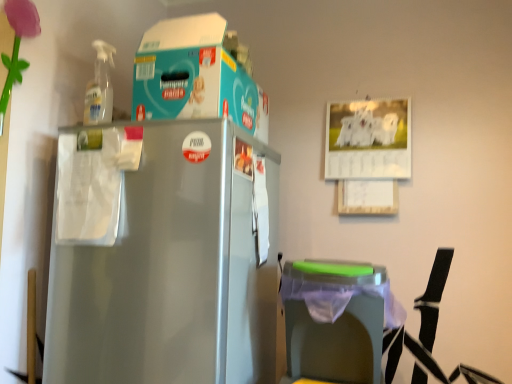
Question: Can you confirm if teal cardboard box at upper center is shorter than green plastic trash can at lower right?

Choices:
 (A) yes
 (B) no

Answer: (A)

Question: Can you confirm if teal cardboard box at upper center is thinner than green plastic trash can at lower right?

Choices:
 (A) yes
 (B) no

Answer: (B)

Question: From the image's perspective, would you say teal cardboard box at upper center is positioned over green plastic trash can at lower right?

Choices:
 (A) no
 (B) yes

Answer: (B)

Question: Is teal cardboard box at upper center facing away from green plastic trash can at lower right?

Choices:
 (A) yes
 (B) no

Answer: (B)

Question: Is the position of teal cardboard box at upper center less distant than that of green plastic trash can at lower right?

Choices:
 (A) no
 (B) yes

Answer: (A)

Question: Is the depth of teal cardboard box at upper center greater than that of green plastic trash can at lower right?

Choices:
 (A) yes
 (B) no

Answer: (A)

Question: Considering the relative positions of green plastic trash can at lower right and teal cardboard box at upper center in the image provided, is green plastic trash can at lower right to the right of teal cardboard box at upper center from the viewer's perspective?

Choices:
 (A) yes
 (B) no

Answer: (A)

Question: Does green plastic trash can at lower right have a lesser height compared to teal cardboard box at upper center?

Choices:
 (A) no
 (B) yes

Answer: (A)

Question: Considering the relative positions of green plastic trash can at lower right and teal cardboard box at upper center in the image provided, is green plastic trash can at lower right behind teal cardboard box at upper center?

Choices:
 (A) no
 (B) yes

Answer: (A)

Question: Is green plastic trash can at lower right not inside teal cardboard box at upper center?

Choices:
 (A) yes
 (B) no

Answer: (A)

Question: From a real-world perspective, is green plastic trash can at lower right on top of teal cardboard box at upper center?

Choices:
 (A) no
 (B) yes

Answer: (A)

Question: Would you say teal cardboard box at upper center is part of green plastic trash can at lower right's contents?

Choices:
 (A) no
 (B) yes

Answer: (A)

Question: Based on their sizes in the image, would you say teal cardboard box at upper center is bigger or smaller than green plastic trash can at lower right?

Choices:
 (A) small
 (B) big

Answer: (B)